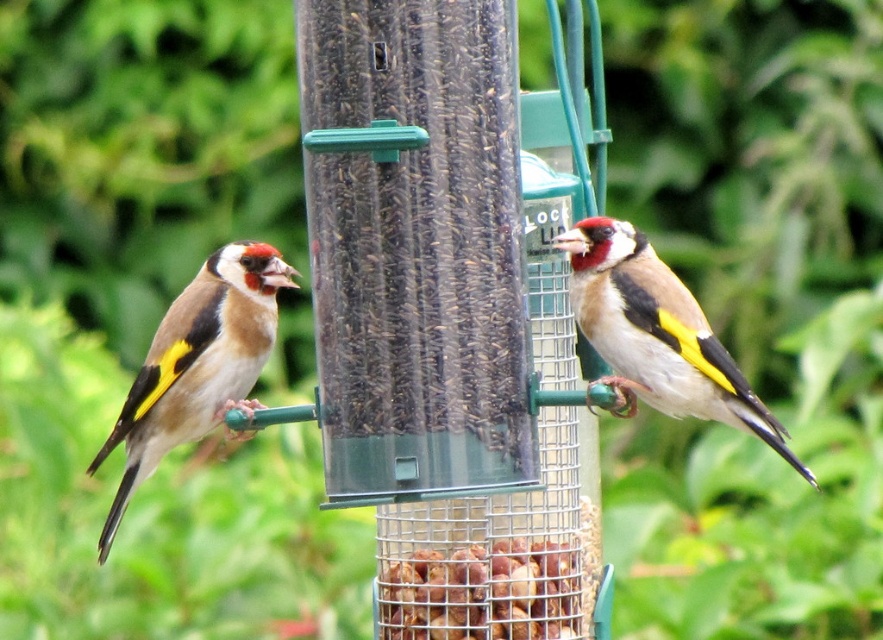
Question: Which point is closer to the camera taking this photo?

Choices:
 (A) (776, 429)
 (B) (155, 406)

Answer: (A)

Question: Is yellow-black speckled bird at right bigger than brown textured nuts at center?

Choices:
 (A) yes
 (B) no

Answer: (A)

Question: Where is yellow-black speckled bird at right located in relation to golden-yellow feathers at left in the image?

Choices:
 (A) right
 (B) left

Answer: (A)

Question: Can you confirm if yellow-black speckled bird at right is thinner than brown textured nuts at center?

Choices:
 (A) no
 (B) yes

Answer: (A)

Question: Considering the real-world distances, which object is closest to the brown textured nuts at center?

Choices:
 (A) golden-yellow feathers at left
 (B) yellow-black speckled bird at right

Answer: (B)

Question: Which object is positioned farthest from the golden-yellow feathers at left?

Choices:
 (A) yellow-black speckled bird at right
 (B) brown textured nuts at center

Answer: (A)